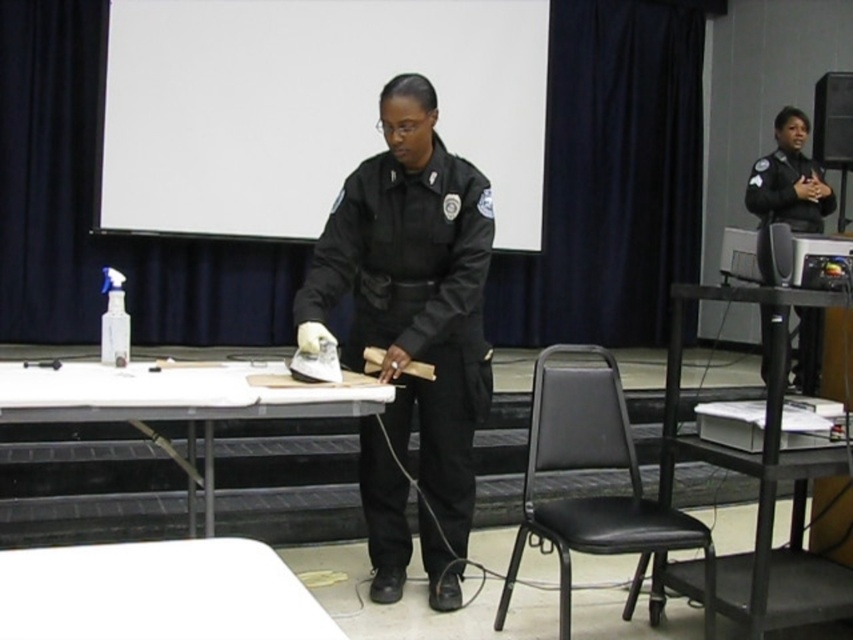
Question: Observing the image, what is the correct spatial positioning of black metal table at lower right in reference to black smooth uniform at center?

Choices:
 (A) left
 (B) right

Answer: (A)

Question: Which object appears closest to the camera in this image?

Choices:
 (A) white plastic table at lower left
 (B) black matte uniform at upper right
 (C) white matte projection screen at upper center
 (D) black matte uniform at center

Answer: (A)

Question: Estimate the real-world distances between objects in this image. Which object is closer to the white plastic table at lower left?

Choices:
 (A) black metal table at lower right
 (B) white plastic table at center

Answer: (B)

Question: Does black matte uniform at center have a smaller size compared to black leather chair at center?

Choices:
 (A) no
 (B) yes

Answer: (A)

Question: Does white plastic table at lower left appear on the left side of white plastic table at center?

Choices:
 (A) yes
 (B) no

Answer: (B)

Question: Which is farther from the white plastic table at center?

Choices:
 (A) black matte uniform at upper right
 (B) black matte uniform at center
 (C) black smooth uniform at center

Answer: (A)